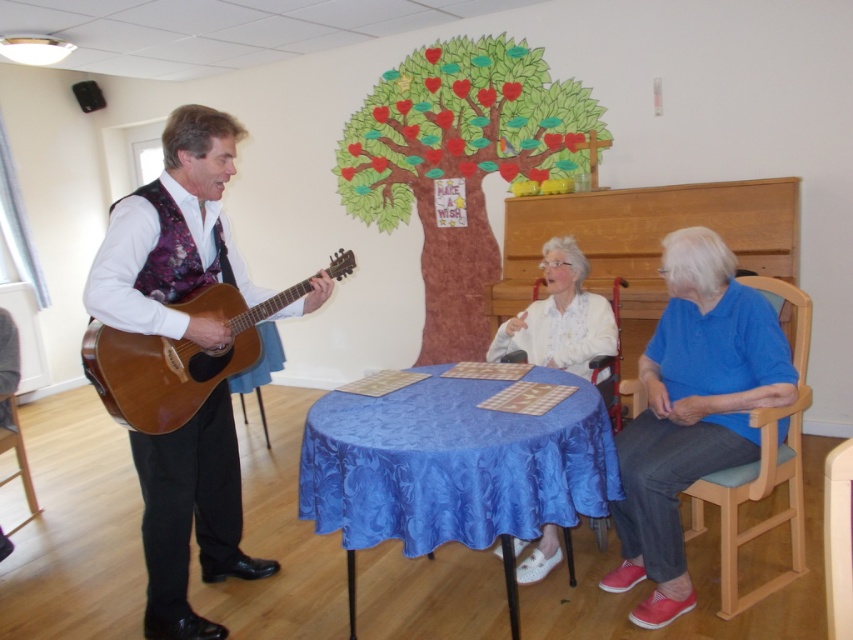
Can you confirm if brown wooden guitar at left is shorter than white satin blouse at center?

Yes.

How distant is brown wooden guitar at left from white satin blouse at center?

brown wooden guitar at left is 1.20 meters away from white satin blouse at center.

Is point (135, 410) positioned in front of point (527, 333)?

Yes, it is in front of point (527, 333).

Where is `brown wooden guitar at left`? brown wooden guitar at left is located at coordinates (175, 358).

This screenshot has width=853, height=640. Describe the element at coordinates (173, 236) in the screenshot. I see `wooden acoustic guitar at left` at that location.

Who is shorter, wooden acoustic guitar at left or blue fabric table at center?

Standing shorter between the two is blue fabric table at center.

Find the location of a particular element. wooden acoustic guitar at left is located at coordinates (173, 236).

Image resolution: width=853 pixels, height=640 pixels. What are the coordinates of `wooden acoustic guitar at left` in the screenshot? It's located at (173, 236).

Is blue satin table at center to the right of white satin blouse at center from the viewer's perspective?

In fact, blue satin table at center is to the left of white satin blouse at center.

Which is in front, point (369, 445) or point (544, 540)?

Positioned in front is point (369, 445).

Does point (602, 428) come closer to viewer compared to point (567, 349)?

That is True.

Find the location of a particular element. The height and width of the screenshot is (640, 853). blue satin table at center is located at coordinates (451, 465).